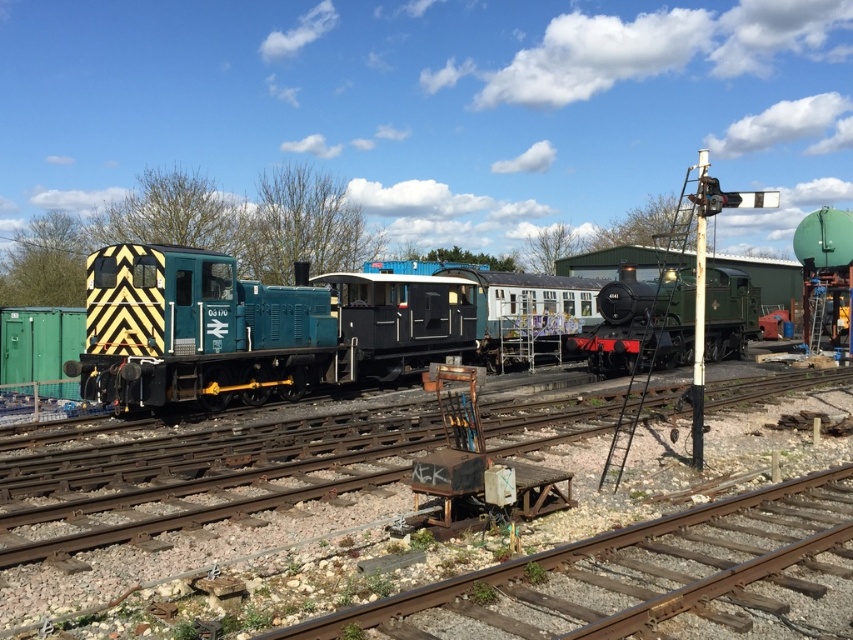
Question: Can you confirm if teal painted metal locomotive at center is thinner than green polished wood steam locomotive at center?

Choices:
 (A) no
 (B) yes

Answer: (A)

Question: Considering the real-world distances, which object is farthest from the rusty metal train track at lower center?

Choices:
 (A) green polished wood steam locomotive at center
 (B) teal matte locomotive at left
 (C) teal painted metal locomotive at center

Answer: (A)

Question: Is rusty metal train track at lower center positioned before teal matte locomotive at left?

Choices:
 (A) no
 (B) yes

Answer: (B)

Question: Is teal matte locomotive at left further to the viewer compared to green polished wood steam locomotive at center?

Choices:
 (A) no
 (B) yes

Answer: (A)

Question: Estimate the real-world distances between objects in this image. Which object is closer to the rusty metal train track at lower center?

Choices:
 (A) teal painted metal locomotive at center
 (B) green polished wood steam locomotive at center
 (C) teal matte locomotive at left

Answer: (C)

Question: Which of the following is the farthest from the observer?

Choices:
 (A) teal painted metal locomotive at center
 (B) green polished wood steam locomotive at center
 (C) rusty metal train track at lower center

Answer: (B)